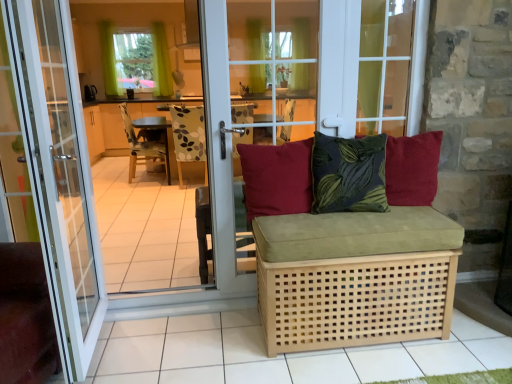
What are the coordinates of `unoccupied area in front of dark green velvet cushion at center, the second pillow when ordered from left to right` in the screenshot? It's located at click(x=368, y=228).